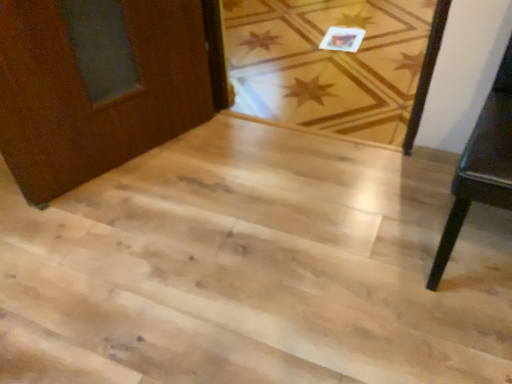
Question: Would you say dark wood table at right is to the left or to the right of light wood floor at center in the picture?

Choices:
 (A) right
 (B) left

Answer: (A)

Question: From the image's perspective, is dark wood table at right above or below light wood floor at center?

Choices:
 (A) above
 (B) below

Answer: (B)

Question: Which object is the closest to the light wood stairs at center?

Choices:
 (A) light wood floor at center
 (B) dark wood table at right

Answer: (B)

Question: Estimate the real-world distances between objects in this image. Which object is farther from the light wood floor at center?

Choices:
 (A) dark wood table at right
 (B) light wood stairs at center

Answer: (A)